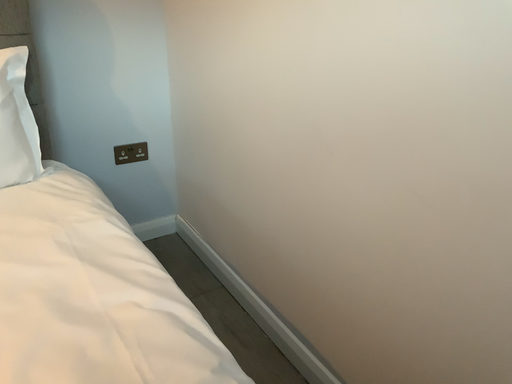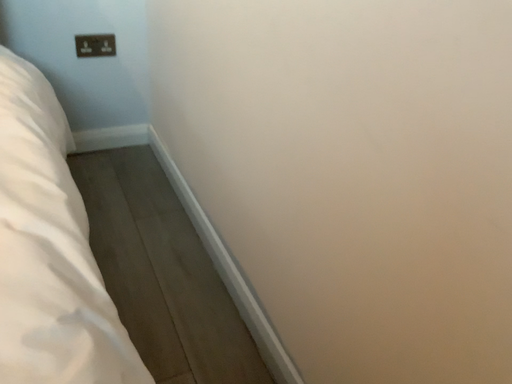
Question: How did the camera likely rotate when shooting the video?

Choices:
 (A) rotated downward
 (B) rotated upward

Answer: (A)